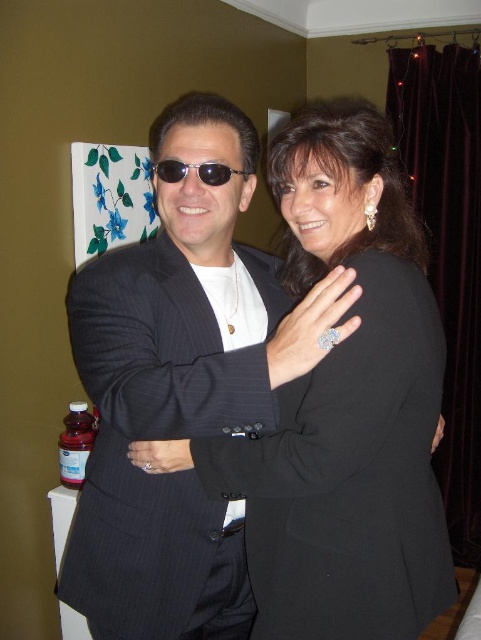
You are a photographer at the event and want to capture a photo that includes both the pinstriped wool suit at center and the black metallic sunglasses at center. Which object should you focus on first to ensure both are in frame?

The pinstriped wool suit at center is positioned under the black metallic sunglasses at center, so you should focus on the black metallic sunglasses at center first to ensure both are in frame.

You are a photographer trying to capture a candid shot of the black pinstripe suit at center and the black metallic sunglasses at center. Which object should you focus on first if you want to ensure both are in frame without moving the camera?

The black pinstripe suit at center is much taller than the black metallic sunglasses at center, so you should focus on the black pinstripe suit at center first to ensure it fits within the frame before adjusting for the smaller sunglasses.